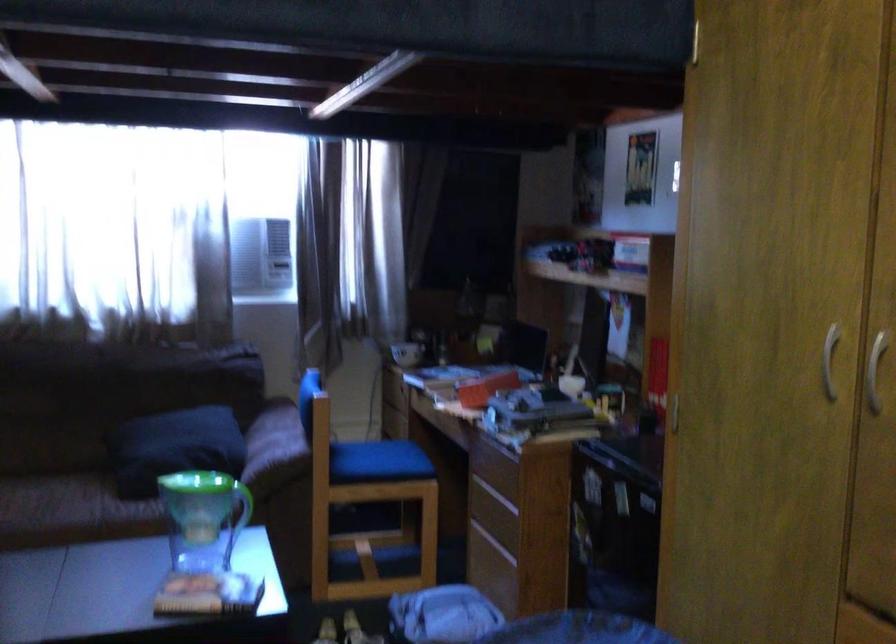
Where is `brown sofa sitting surface`? This screenshot has height=644, width=896. brown sofa sitting surface is located at coordinates tap(126, 364).